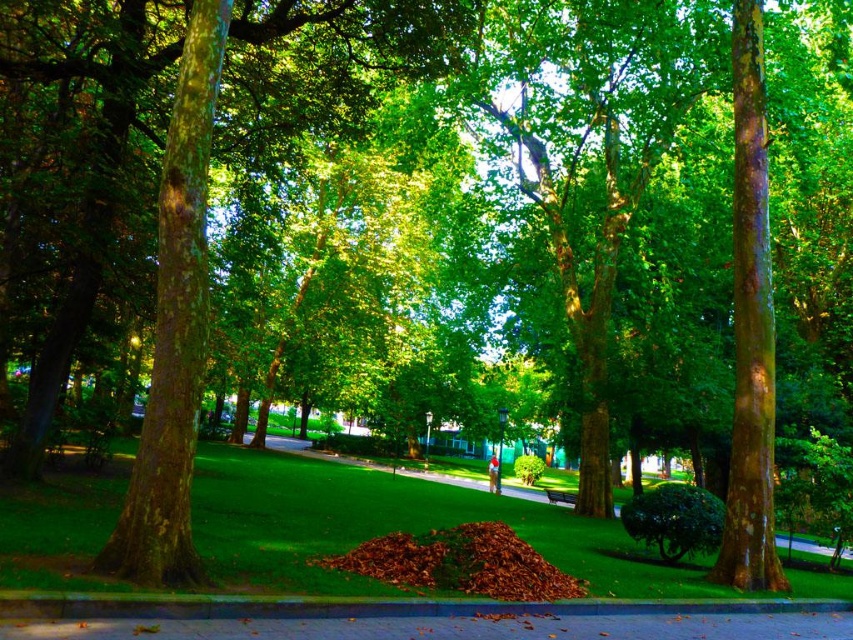
Question: Which of the following is the closest to the observer?

Choices:
 (A) green grass at center
 (B) green wooden bench at center

Answer: (A)

Question: Can you confirm if green grass at center is thinner than green wooden bench at center?

Choices:
 (A) no
 (B) yes

Answer: (A)

Question: Does green grass at center appear over green wooden bench at center?

Choices:
 (A) yes
 (B) no

Answer: (A)

Question: Which of the following is the farthest from the observer?

Choices:
 (A) green grass at center
 (B) green wooden bench at center

Answer: (B)

Question: Can you confirm if green grass at center is positioned to the right of green wooden bench at center?

Choices:
 (A) no
 (B) yes

Answer: (A)